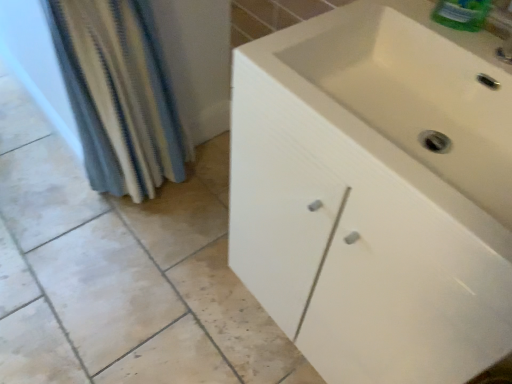
Where is `vacant space that's between white matte cabinet at center and blue striped fabric at left`? vacant space that's between white matte cabinet at center and blue striped fabric at left is located at coordinates (190, 258).